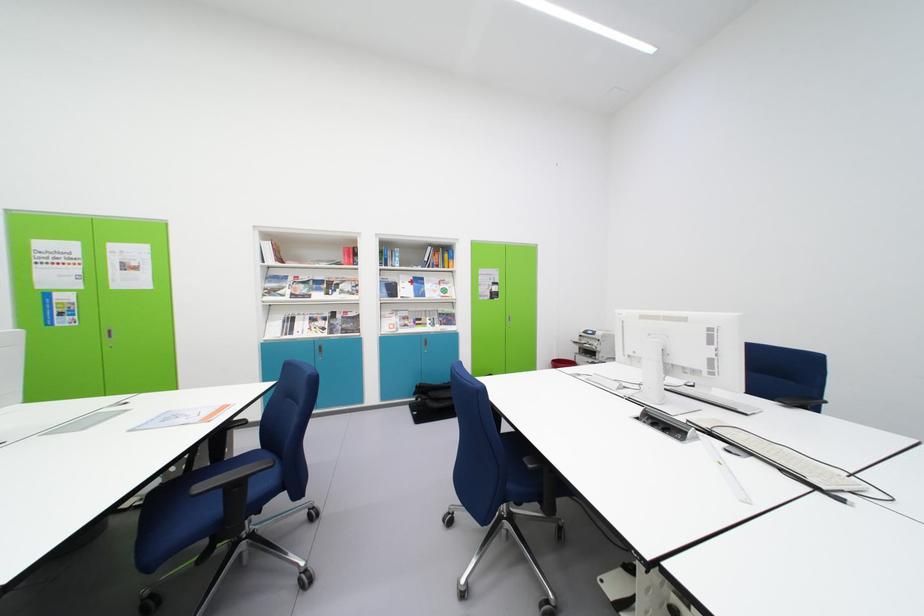
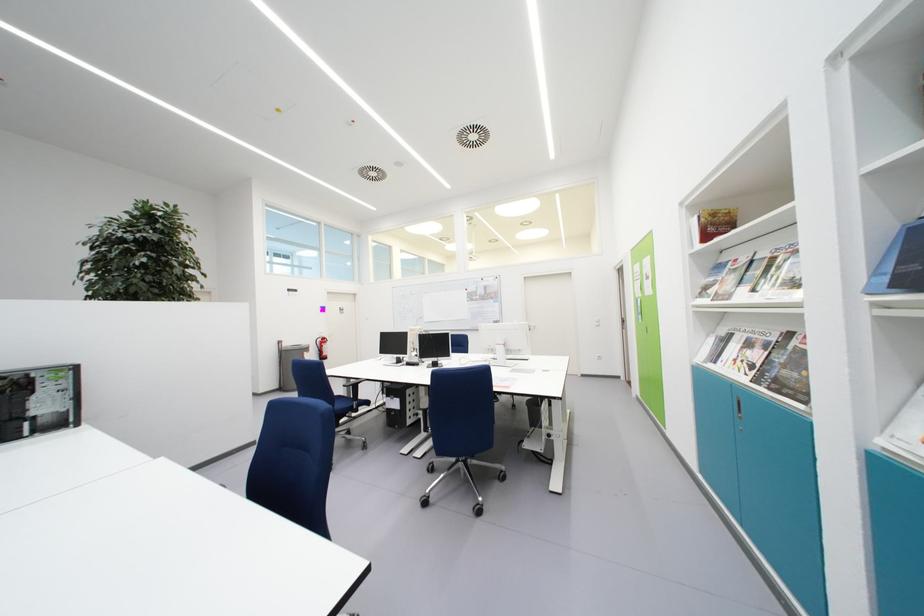
Where in the second image is the point corresponding to (x=320, y=323) from the first image?

(755, 349)